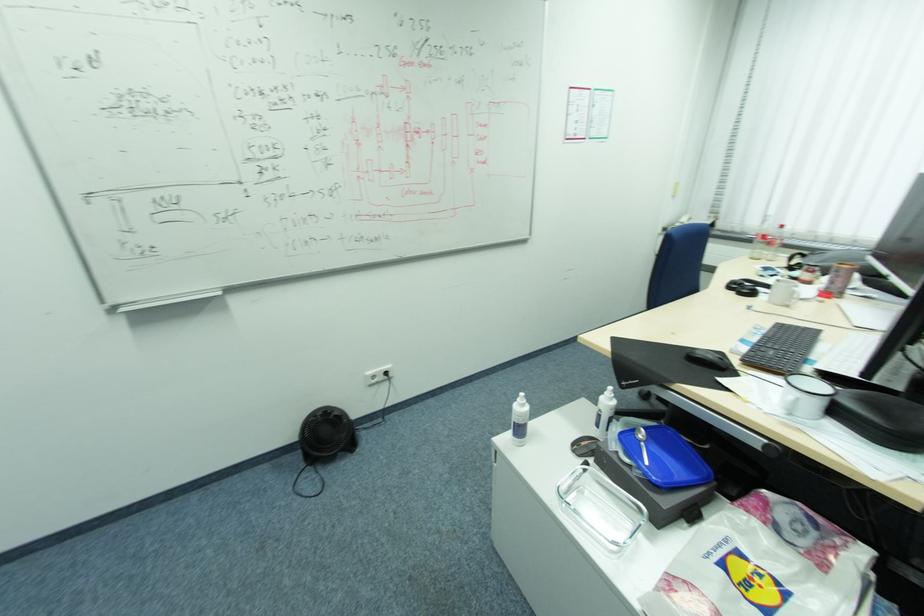
Where would you grasp the black headphones? Please return your answer as a coordinate pair (x, y).

(322, 442)